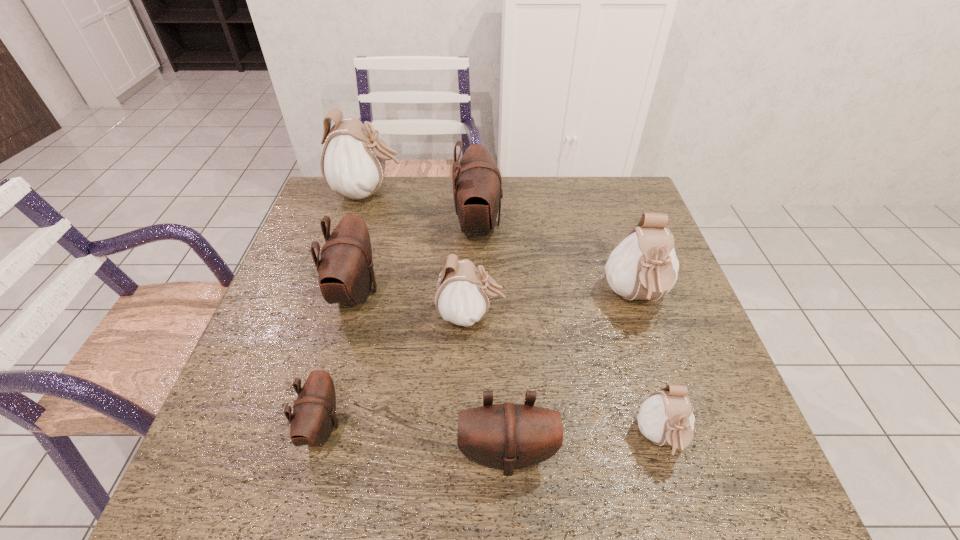
This screenshot has height=540, width=960. What are the coordinates of `vacant region located with the flap open on the biggest brown pouch` in the screenshot? It's located at (625, 224).

Find the location of a particular element. The width and height of the screenshot is (960, 540). free space located 0.100m on the front-facing side of the second biggest white pouch is located at coordinates (659, 366).

In order to click on free location located with the flap open on the third smallest brown pouch in this screenshot , I will do `click(508, 291)`.

You are a GUI agent. You are given a task and a screenshot of the screen. Output one action in this format:
    pyautogui.click(x=<x>, y=<y>)
    Task: Click on the free space located on the front-facing side of the third white pouch from right to left
    The width and height of the screenshot is (960, 540).
    Given the screenshot: What is the action you would take?
    pyautogui.click(x=537, y=315)

You are a GUI agent. You are given a task and a screenshot of the screen. Output one action in this format:
    pyautogui.click(x=<x>, y=<y>)
    Task: Click on the blank area located 0.360m with the flap open on the smallest brown pouch
    
    Given the screenshot: What is the action you would take?
    pyautogui.click(x=522, y=426)

This screenshot has height=540, width=960. I want to click on object that is at the far left corner, so click(353, 160).

Where is `object at the near right corner`? The width and height of the screenshot is (960, 540). object at the near right corner is located at coordinates (666, 418).

Locate an element on the screen. free location at the far edge of the desktop is located at coordinates (588, 197).

Locate an element on the screen. Image resolution: width=960 pixels, height=540 pixels. free region at the near edge of the desktop is located at coordinates (370, 472).

Identify the location of vacant space at the left edge of the desktop. This screenshot has height=540, width=960. (234, 383).